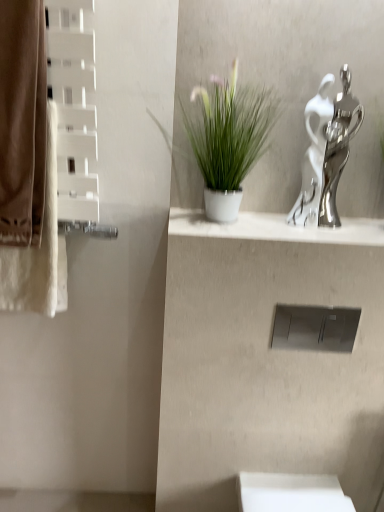
You are a GUI agent. You are given a task and a screenshot of the screen. Output one action in this format:
    pyautogui.click(x=<x>, y=<y>)
    Task: Click on the free space between green matte plant at center and silver metallic sculpture at upper right
    
    Given the screenshot: What is the action you would take?
    pyautogui.click(x=292, y=224)